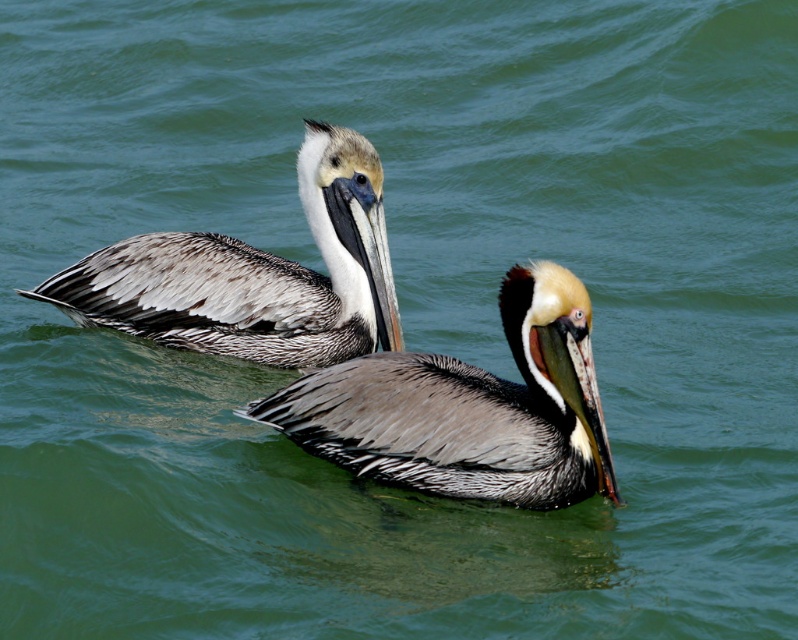
You are standing on a boat and see the brown feathered pelican at center in the water. If you want to throw a small fish to the pelican, and your throwing range is 3 meters, will you be able to reach it?

The distance between you and the brown feathered pelican at center is 3.63 meters, which is beyond your 3 meters throwing range. Therefore, you cannot reach it.

You are a wildlife photographer aiming to capture both the brown feathered pelican at center and the brown speckled pelican at upper left in a single frame. Given your camera has a 24mm lens with a field of view of 75 degrees, can you estimate if both pelicans will fit in the frame without moving the camera?

The distance between the brown feathered pelican at center and the brown speckled pelican at upper left is 34.85 inches. To determine if they fit in a 75 degree field of view with a 24mm lens, we must calculate the angular separation. However, without knowing the exact distance from the camera to the pelicans, we cannot accurately compute the angle. Thus, it is uncertain if both will fit without additional information.

You are observing two points in the image of the pelicans. Which point is nearer to you, point (496, 394) or point (184, 317)?

Point (496, 394) is closer to the viewer than point (184, 317).